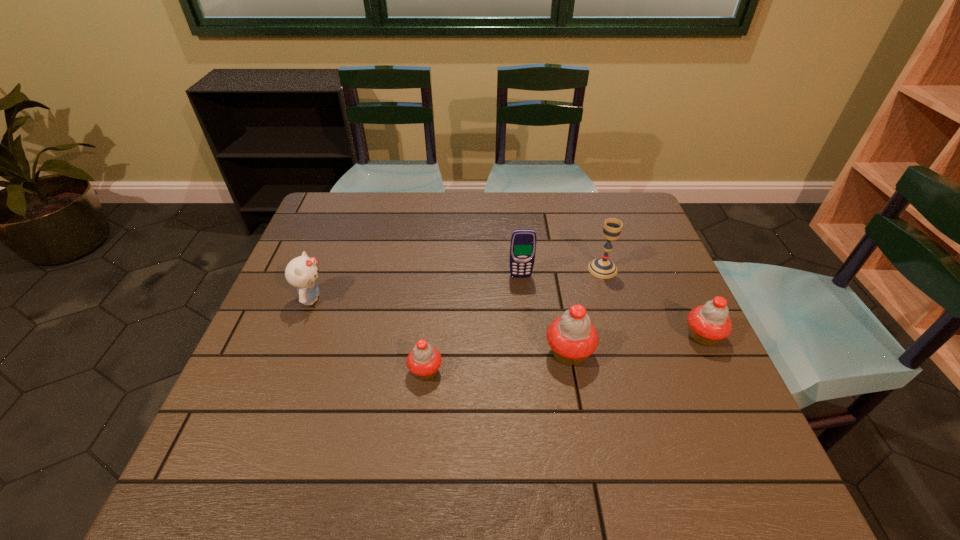
Image resolution: width=960 pixels, height=540 pixels. In the image, there is a desktop. Identify the location of vacant space at the near edge. (x=396, y=436).

Identify the location of vacant region at the left edge. The width and height of the screenshot is (960, 540). (254, 392).

In the image, there is a desktop. At what (x,y) coordinates should I click in order to perform the action: click on blank space at the right edge. Please return your answer as a coordinate pair (x, y). Looking at the image, I should click on (666, 276).

Identify the location of free space at the near left corner of the desktop. (277, 409).

Find the location of a particular element. The image size is (960, 540). free spot at the far right corner of the desktop is located at coordinates (594, 198).

This screenshot has width=960, height=540. In order to click on vacant point located between the tallest cupcake and the leftmost object in this screenshot , I will do `click(441, 326)`.

At what (x,y) coordinates should I click in order to perform the action: click on vacant area between the fifth object from right to left and the fourth object from right to left. Please return your answer as a coordinate pair (x, y). This screenshot has width=960, height=540. Looking at the image, I should click on (473, 323).

Image resolution: width=960 pixels, height=540 pixels. In order to click on free area in between the second object from right to left and the third object from left to right in this screenshot , I will do `click(562, 273)`.

Locate an element on the screen. The image size is (960, 540). vacant area that lies between the leftmost cupcake and the kitten is located at coordinates (369, 335).

Identify the location of vacant area between the second tallest cupcake and the fourth nearest object. The height and width of the screenshot is (540, 960). (x=507, y=318).